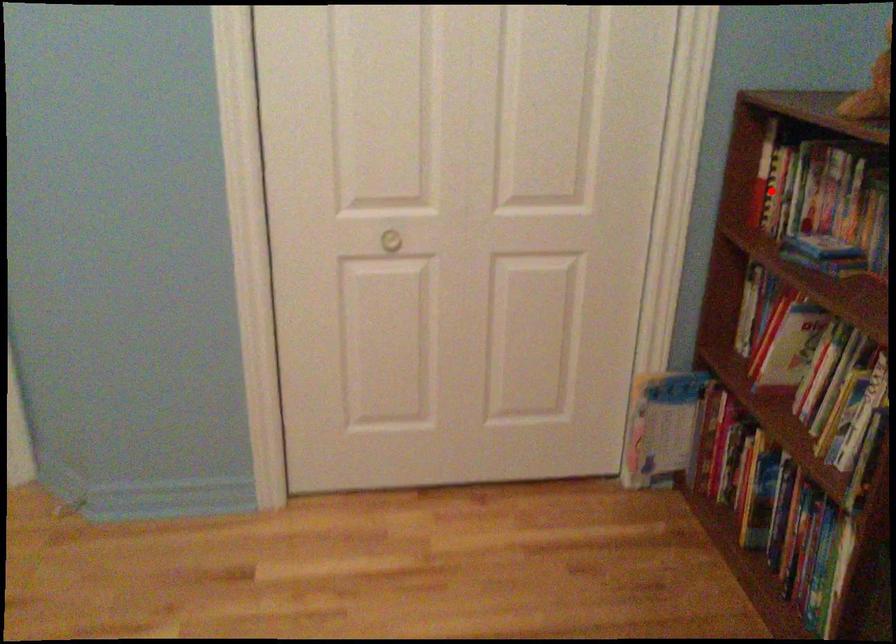
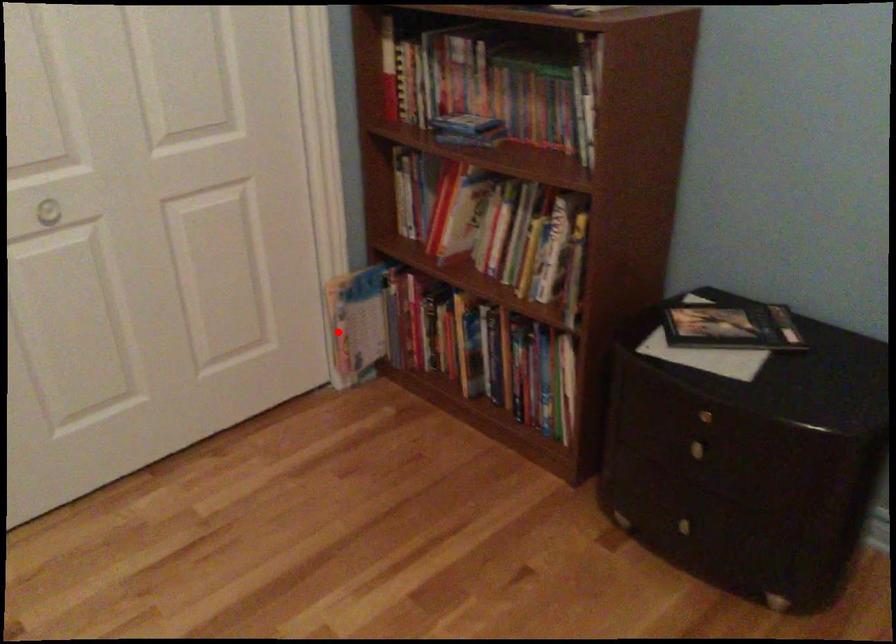
I am providing you with two images of the same scene from different viewpoints. A red point is marked on the first image and another point is marked on the second image. Are the points marked in image1 and image2 representing the same 3D position?

No